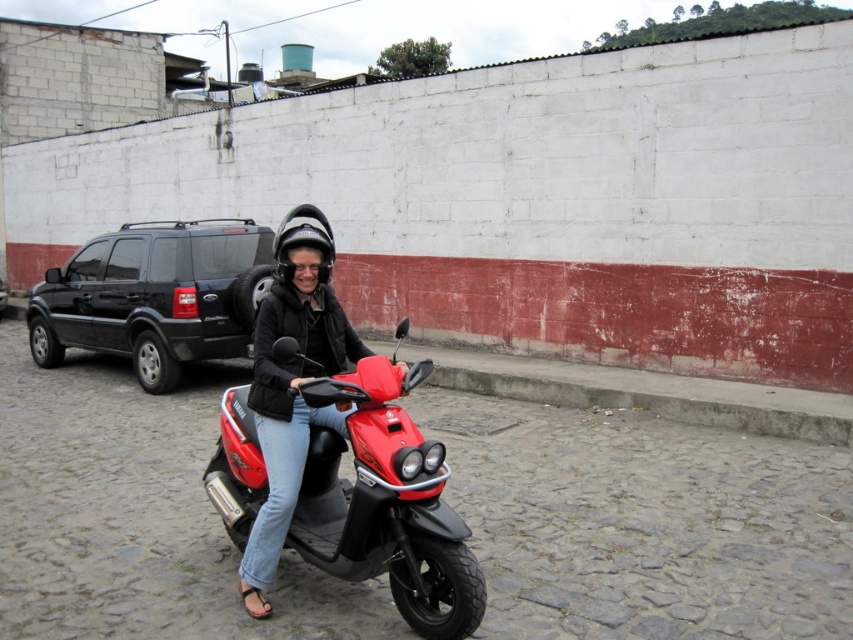
Who is lower down, shiny red scooter at center or matte black helmet at upper center?

shiny red scooter at center is lower down.

Who is more forward, (401,522) or (259,605)?

Point (401,522) is in front.

The image size is (853, 640). What do you see at coordinates (386, 502) in the screenshot?
I see `shiny red scooter at center` at bounding box center [386, 502].

Find the location of a particular element. The image size is (853, 640). shiny red scooter at center is located at coordinates (386, 502).

How distant is shiny red scooter at center from black matte helmet at center?

shiny red scooter at center and black matte helmet at center are 3.98 feet apart from each other.

Is shiny red scooter at center further to the viewer compared to black matte helmet at center?

No.

Which is in front, point (425, 476) or point (312, 211)?

Point (425, 476)

Identify the location of shiny red scooter at center. This screenshot has width=853, height=640. (386, 502).

Is black matte suv at left shorter than matte black helmet at upper center?

No.

Does black matte suv at left appear on the left side of matte black helmet at upper center?

Indeed, black matte suv at left is positioned on the left side of matte black helmet at upper center.

Is point (100, 288) closer to viewer compared to point (350, 358)?

That is False.

Identify the location of black matte suv at left. (155, 296).